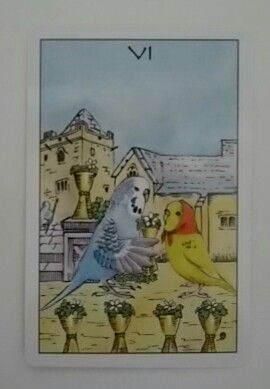
Image resolution: width=270 pixels, height=389 pixels. I want to click on picture, so click(155, 273).